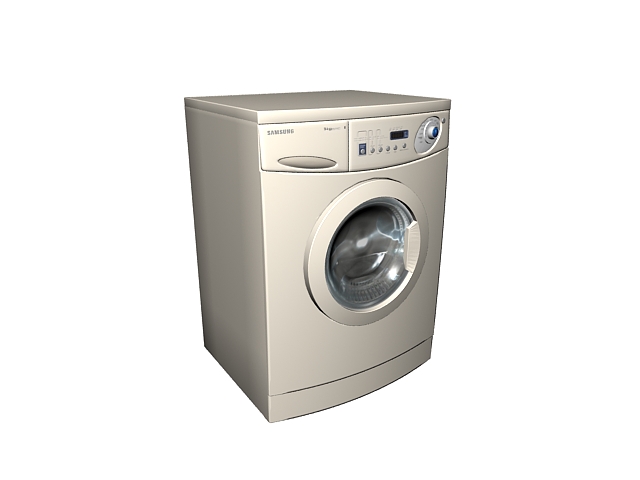
Where is `white handle`? This screenshot has width=640, height=480. white handle is located at coordinates (410, 250).